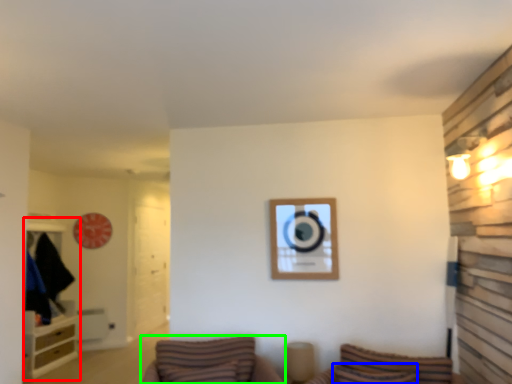
Question: Which is nearer to the entertainment center (highlighted by a red box)? pillow (highlighted by a blue box) or furniture (highlighted by a green box).

Choices:
 (A) pillow
 (B) furniture

Answer: (B)